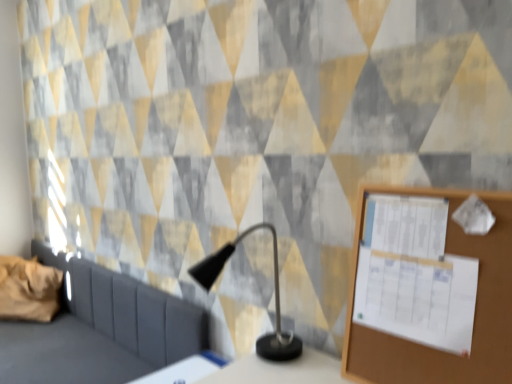
Question: Is white glossy table at lower center smaller than black matte table lamp at center?

Choices:
 (A) no
 (B) yes

Answer: (B)

Question: Considering the relative sizes of white glossy table at lower center and black matte table lamp at center in the image provided, is white glossy table at lower center wider than black matte table lamp at center?

Choices:
 (A) no
 (B) yes

Answer: (A)

Question: From a real-world perspective, is white glossy table at lower center on top of black matte table lamp at center?

Choices:
 (A) yes
 (B) no

Answer: (B)

Question: Would you say black matte table lamp at center is part of white glossy table at lower center's contents?

Choices:
 (A) no
 (B) yes

Answer: (A)

Question: Is black matte table lamp at center at the back of white glossy table at lower center?

Choices:
 (A) yes
 (B) no

Answer: (B)

Question: Does white glossy table at lower center have a lesser height compared to black matte table lamp at center?

Choices:
 (A) yes
 (B) no

Answer: (A)

Question: Does dark gray fabric sofa at left lie behind brown fabric pillow at left?

Choices:
 (A) yes
 (B) no

Answer: (B)

Question: From a real-world perspective, is dark gray fabric sofa at left below brown fabric pillow at left?

Choices:
 (A) no
 (B) yes

Answer: (B)

Question: Does dark gray fabric sofa at left have a smaller size compared to brown fabric pillow at left?

Choices:
 (A) no
 (B) yes

Answer: (A)

Question: From the image's perspective, is dark gray fabric sofa at left located beneath brown fabric pillow at left?

Choices:
 (A) yes
 (B) no

Answer: (A)

Question: Is dark gray fabric sofa at left to the right of brown fabric pillow at left from the viewer's perspective?

Choices:
 (A) no
 (B) yes

Answer: (B)

Question: Is dark gray fabric sofa at left not within brown fabric pillow at left?

Choices:
 (A) yes
 (B) no

Answer: (A)

Question: Does wooden bulletin board at right contain white glossy table at lower center?

Choices:
 (A) yes
 (B) no

Answer: (B)